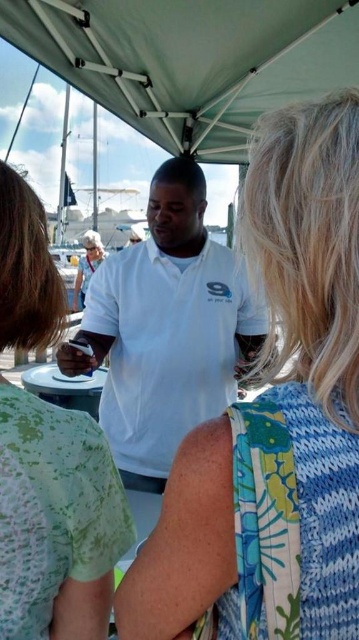
Is floral fabric dress at center shorter than white fabric canopy at upper center?

Incorrect, floral fabric dress at center's height does not fall short of white fabric canopy at upper center's.

Based on the photo, which of these two, floral fabric dress at center or white fabric canopy at upper center, stands taller?

Standing taller between the two is floral fabric dress at center.

Find the location of a particular element. floral fabric dress at center is located at coordinates (274, 420).

From the picture: Is white fabric canopy at upper center smaller than white matte shirt at center?

Incorrect, white fabric canopy at upper center is not smaller in size than white matte shirt at center.

How far apart are white fabric canopy at upper center and white matte shirt at center?

white fabric canopy at upper center and white matte shirt at center are 1.20 meters apart.

Where is `white fabric canopy at upper center`? white fabric canopy at upper center is located at coordinates (190, 60).

Is green textured blouse at center smaller than white matte shirt at center?

Correct, green textured blouse at center occupies less space than white matte shirt at center.

Consider the image. Between green textured blouse at center and white matte shirt at center, which one is positioned higher?

white matte shirt at center

Is point (62, 298) less distant than point (193, 308)?

Yes, point (62, 298) is in front of point (193, 308).

Image resolution: width=359 pixels, height=640 pixels. What are the coordinates of `green textured blouse at center` in the screenshot? It's located at (56, 520).